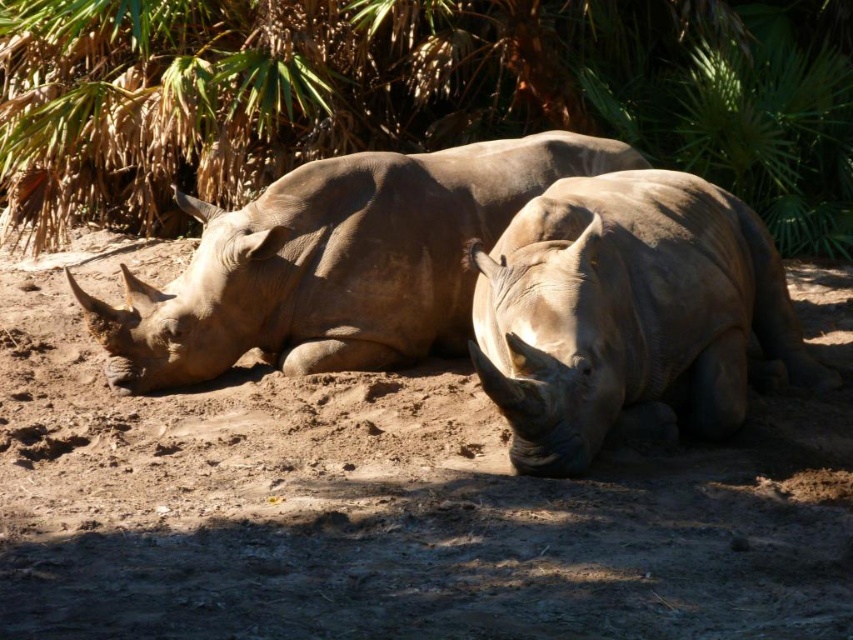
Question: Does brown sandy dirt at center come behind green leafy tree at upper center?

Choices:
 (A) yes
 (B) no

Answer: (B)

Question: Does brown sandy dirt at center appear on the left side of green leafy tree at upper center?

Choices:
 (A) no
 (B) yes

Answer: (A)

Question: Which of the following is the farthest from the observer?

Choices:
 (A) green leafy tree at upper center
 (B) smooth gray rhino at center
 (C) gray matte rhino at center

Answer: (A)

Question: Which point is closer to the camera?

Choices:
 (A) (442, 304)
 (B) (849, 225)
 (C) (546, 444)

Answer: (C)

Question: Which point appears farthest from the camera in this image?

Choices:
 (A) pyautogui.click(x=148, y=419)
 (B) pyautogui.click(x=198, y=358)
 (C) pyautogui.click(x=132, y=225)

Answer: (C)

Question: Does brown sandy dirt at center appear over smooth gray rhino at center?

Choices:
 (A) yes
 (B) no

Answer: (B)